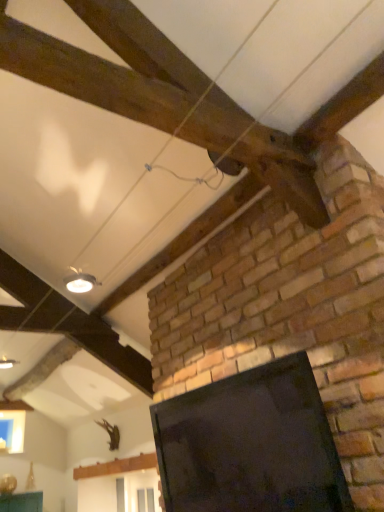
Question: Is black glossy screen at center in front of or behind white glossy light fixture at upper left in the image?

Choices:
 (A) behind
 (B) front

Answer: (B)

Question: In the image, is black glossy screen at center on the left side or the right side of white glossy light fixture at upper left?

Choices:
 (A) right
 (B) left

Answer: (A)

Question: In terms of width, does black glossy screen at center look wider or thinner when compared to white glossy light fixture at upper left?

Choices:
 (A) wide
 (B) thin

Answer: (A)

Question: Does point (86, 274) appear closer or farther from the camera than point (306, 501)?

Choices:
 (A) closer
 (B) farther

Answer: (B)

Question: Relative to black glossy screen at center, is white glossy light fixture at upper left in front or behind?

Choices:
 (A) front
 (B) behind

Answer: (B)

Question: Considering the positions of white glossy light fixture at upper left and black glossy screen at center in the image, is white glossy light fixture at upper left wider or thinner than black glossy screen at center?

Choices:
 (A) thin
 (B) wide

Answer: (A)

Question: In terms of height, does white glossy light fixture at upper left look taller or shorter compared to black glossy screen at center?

Choices:
 (A) short
 (B) tall

Answer: (A)